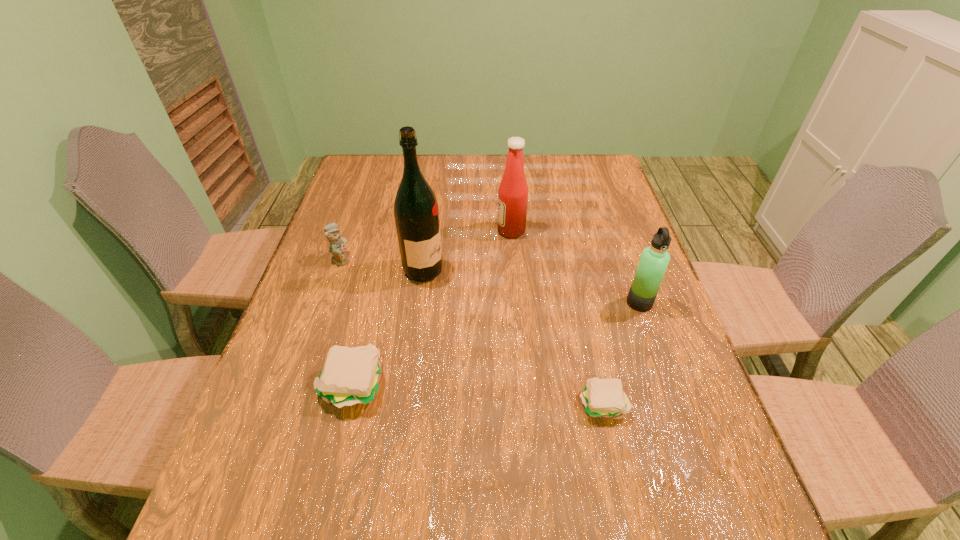
Identify the location of the fifth closest object to the second shortest object. click(x=654, y=260).

Identify the location of vacant space that satisfies the following two spatial constraints: 1. on the front-facing side of the tallest object; 2. on the front side of the taller patty. This screenshot has height=540, width=960. (408, 385).

Where is `vacant space that satisfies the following two spatial constraints: 1. on the front-facing side of the liquor; 2. on the front side of the taller patty`? The width and height of the screenshot is (960, 540). vacant space that satisfies the following two spatial constraints: 1. on the front-facing side of the liquor; 2. on the front side of the taller patty is located at coordinates (408, 385).

Identify the location of vacant position in the image that satisfies the following two spatial constraints: 1. on the back side of the thermos bottle; 2. on the right side of the taller patty. The image size is (960, 540). (372, 302).

Locate an element on the screen. vacant point that satisfies the following two spatial constraints: 1. on the front-facing side of the fifth shortest object; 2. on the back side of the rightmost object is located at coordinates (516, 302).

Where is `vacant region that satisfies the following two spatial constraints: 1. on the front-facing side of the right patty; 2. on the right side of the teddy bear`? vacant region that satisfies the following two spatial constraints: 1. on the front-facing side of the right patty; 2. on the right side of the teddy bear is located at coordinates (292, 403).

Where is `vacant point that satisfies the following two spatial constraints: 1. on the front-facing side of the teddy bear; 2. on the right side of the left patty`? The height and width of the screenshot is (540, 960). vacant point that satisfies the following two spatial constraints: 1. on the front-facing side of the teddy bear; 2. on the right side of the left patty is located at coordinates (299, 385).

The width and height of the screenshot is (960, 540). I want to click on vacant region that satisfies the following two spatial constraints: 1. on the front-facing side of the leftmost object; 2. on the back side of the shorter patty, so click(x=292, y=403).

This screenshot has height=540, width=960. Find the location of `free space that satisfies the following two spatial constraints: 1. on the front-facing side of the liquor; 2. on the back side of the third nearest object`. free space that satisfies the following two spatial constraints: 1. on the front-facing side of the liquor; 2. on the back side of the third nearest object is located at coordinates (420, 302).

Locate an element on the screen. free space that satisfies the following two spatial constraints: 1. on the back side of the fourth farthest object; 2. on the front-facing side of the liquor is located at coordinates (628, 271).